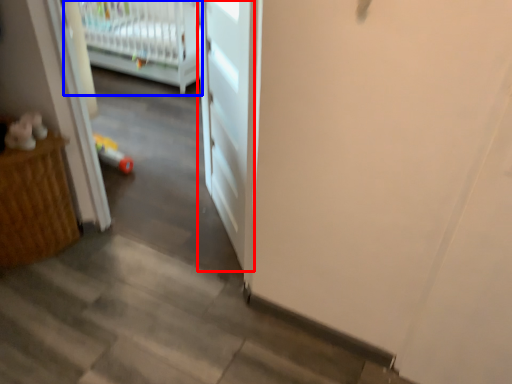
Question: Which point is further to the camera, door (highlighted by a red box) or infant bed (highlighted by a blue box)?

Choices:
 (A) door
 (B) infant bed

Answer: (B)